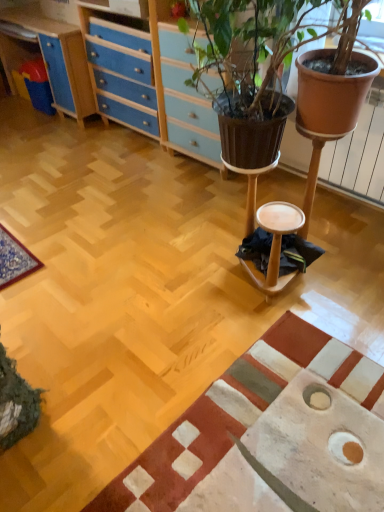
Describe the element at coordinates (276, 243) in the screenshot. Image resolution: width=384 pixels, height=512 pixels. I see `wooden stool at center` at that location.

This screenshot has height=512, width=384. Describe the element at coordinates (236, 413) in the screenshot. I see `textured beige rug at lower right` at that location.

Where is `blue wood/file cabinet at upper left`? blue wood/file cabinet at upper left is located at coordinates (120, 67).

Is point (365, 358) positioned after point (136, 33)?

No, (365, 358) is closer to viewer.

Between textured beige rug at lower right and blue wood/file cabinet at upper left, which one appears on the left side from the viewer's perspective?

blue wood/file cabinet at upper left.

Is textured beige rug at lower right inside the boundaries of blue wood/file cabinet at upper left, or outside?

textured beige rug at lower right exists outside the volume of blue wood/file cabinet at upper left.

Is textured beige rug at lower right far from blue wood/file cabinet at upper left?

textured beige rug at lower right is positioned a significant distance from blue wood/file cabinet at upper left.

Is blue wood/file cabinet at upper left positioned beyond the bounds of wooden stool at center?

Yes.

Is blue wood/file cabinet at upper left taller than wooden stool at center?

Indeed, blue wood/file cabinet at upper left has a greater height compared to wooden stool at center.

Could you tell me if blue wood/file cabinet at upper left is facing wooden stool at center?

No, blue wood/file cabinet at upper left is not oriented towards wooden stool at center.

Locate an element on the screen. mat that is below the wooden stool at center (from the image's perspective) is located at coordinates (236, 413).

Is wooden stool at center positioned beyond the bounds of textured beige rug at lower right?

Absolutely, wooden stool at center is external to textured beige rug at lower right.

Is wooden stool at center bigger than textured beige rug at lower right?

No, wooden stool at center is not bigger than textured beige rug at lower right.

In the scene shown: Is wooden stool at center not near textured beige rug at lower right?

No, wooden stool at center is not far away from textured beige rug at lower right.

Where is `file cabinet above the wooden stool at center (from the image's perspective)`? file cabinet above the wooden stool at center (from the image's perspective) is located at coordinates (120, 67).

From a real-world perspective, is wooden stool at center below blue wood/file cabinet at upper left?

Indeed, from a real-world perspective, wooden stool at center is positioned beneath blue wood/file cabinet at upper left.

Is wooden stool at center beside blue wood/file cabinet at upper left?

No, wooden stool at center is not beside blue wood/file cabinet at upper left.

Considering the positions of objects blue wood/file cabinet at upper left and textured beige rug at lower right in the image provided, who is more to the left, blue wood/file cabinet at upper left or textured beige rug at lower right?

Positioned to the left is blue wood/file cabinet at upper left.

Which object is further away from the camera, blue wood/file cabinet at upper left or textured beige rug at lower right?

Positioned behind is blue wood/file cabinet at upper left.

Is point (110, 16) farther from viewer compared to point (253, 388)?

Yes, it is behind point (253, 388).

Is blue wood/file cabinet at upper left smaller than textured beige rug at lower right?

Incorrect, blue wood/file cabinet at upper left is not smaller in size than textured beige rug at lower right.

Considering the sizes of objects textured beige rug at lower right and wooden stool at center in the image provided, who is thinner, textured beige rug at lower right or wooden stool at center?

Thinner between the two is wooden stool at center.

From a real-world perspective, is textured beige rug at lower right beneath wooden stool at center?

Indeed, from a real-world perspective, textured beige rug at lower right is positioned beneath wooden stool at center.

Locate an element on the screen. The width and height of the screenshot is (384, 512). stool above the textured beige rug at lower right (from the image's perspective) is located at coordinates (276, 243).

Does point (327, 361) lie behind point (266, 291)?

No, (327, 361) is closer to viewer.

The image size is (384, 512). Identify the location of file cabinet behind the textured beige rug at lower right. (120, 67).

The image size is (384, 512). In order to click on stool that appears below the blue wood/file cabinet at upper left (from a real-world perspective) in this screenshot , I will do `click(276, 243)`.

From the image, which object appears to be nearer to wooden stool at center, textured beige rug at lower right or blue wood/file cabinet at upper left?

textured beige rug at lower right lies closer to wooden stool at center than the other object.

From the image, which object appears to be farther from textured beige rug at lower right, blue wood/file cabinet at upper left or wooden stool at center?

Based on the image, blue wood/file cabinet at upper left appears to be further to textured beige rug at lower right.

Looking at the image, which one is located further to blue wood/file cabinet at upper left, textured beige rug at lower right or wooden stool at center?

textured beige rug at lower right lies further to blue wood/file cabinet at upper left than the other object.

Based on their spatial positions, is wooden stool at center or blue wood/file cabinet at upper left closer to textured beige rug at lower right?

→ wooden stool at center.

Which object lies further to the anchor point wooden stool at center, blue wood/file cabinet at upper left or textured beige rug at lower right?

blue wood/file cabinet at upper left.

Which object lies further to the anchor point blue wood/file cabinet at upper left, wooden stool at center or textured beige rug at lower right?

textured beige rug at lower right lies further to blue wood/file cabinet at upper left than the other object.

Locate an element on the screen. The width and height of the screenshot is (384, 512). stool between blue wood/file cabinet at upper left and textured beige rug at lower right from top to bottom is located at coordinates (276, 243).